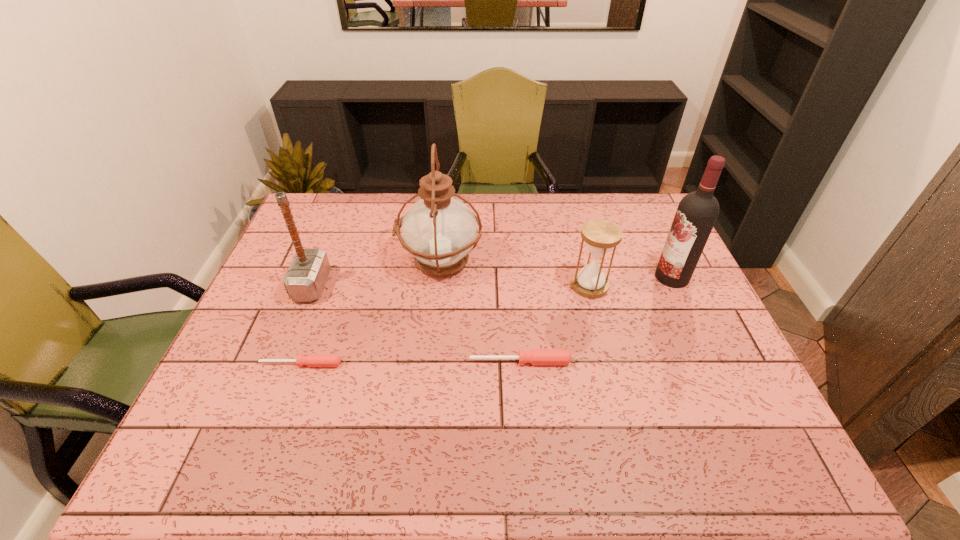
The image size is (960, 540). I want to click on free space at the far edge, so click(x=518, y=221).

In the image, there is a desktop. Where is `vacant space at the near edge`? vacant space at the near edge is located at coordinates (408, 421).

Where is `free space at the left edge of the desktop`? This screenshot has height=540, width=960. free space at the left edge of the desktop is located at coordinates (275, 267).

Image resolution: width=960 pixels, height=540 pixels. In the image, there is a desktop. Identify the location of vacant space at the right edge. pos(662,322).

In the image, there is a desktop. Where is `vacant space at the near right corner`? The width and height of the screenshot is (960, 540). vacant space at the near right corner is located at coordinates (750, 390).

Find the location of `blank region between the left screwdriver and the oil lamp`. blank region between the left screwdriver and the oil lamp is located at coordinates (371, 313).

In order to click on vacant space in between the fourth tallest object and the shortest object in this screenshot , I will do `click(445, 325)`.

I want to click on unoccupied position between the right screwdriver and the oil lamp, so click(x=480, y=312).

You are a GUI agent. You are given a task and a screenshot of the screen. Output one action in this format:
    pyautogui.click(x=<x>, y=<y>)
    Task: Click on the free point between the oil lamp and the wine bottle
    Image resolution: width=960 pixels, height=540 pixels.
    Given the screenshot: What is the action you would take?
    pyautogui.click(x=556, y=269)

Identify the location of unoccupied position between the oil lamp and the hourglass. This screenshot has width=960, height=540. (515, 274).